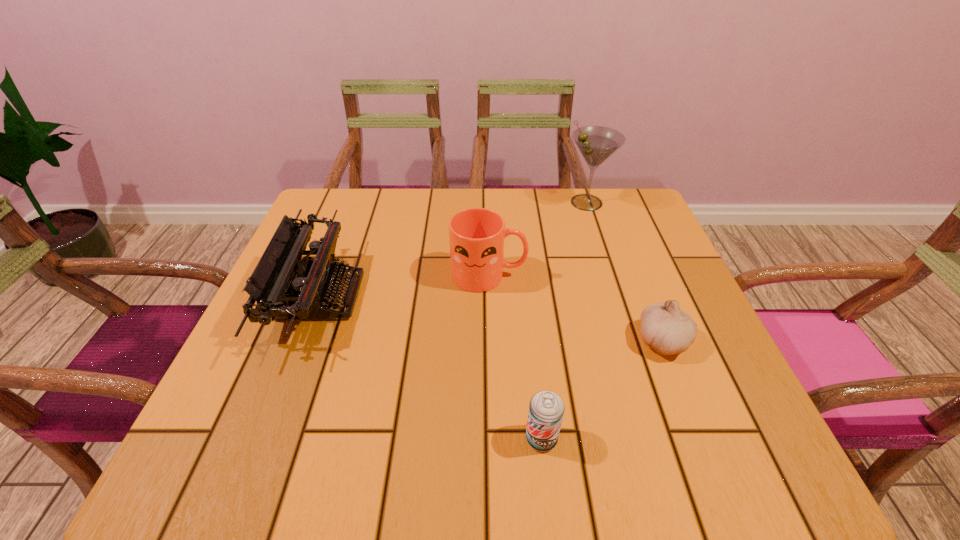
At what (x,y) coordinates should I click in order to perform the action: click on empty space that is in between the beer can and the mug. Please return your answer as a coordinate pair (x, y). The height and width of the screenshot is (540, 960). Looking at the image, I should click on (516, 356).

Where is `empty space that is in between the garlic and the martini`? The width and height of the screenshot is (960, 540). empty space that is in between the garlic and the martini is located at coordinates (625, 272).

Where is `empty location between the leftmost object and the beer can`? empty location between the leftmost object and the beer can is located at coordinates (431, 368).

Locate an element on the screen. This screenshot has width=960, height=540. the second closest object to the garlic is located at coordinates (546, 409).

The width and height of the screenshot is (960, 540). I want to click on the third closest object to the garlic, so click(x=596, y=144).

Locate an element on the screen. Image resolution: width=960 pixels, height=540 pixels. free space that satisfies the following two spatial constraints: 1. on the typing side of the beer can; 2. on the right side of the leftmost object is located at coordinates (266, 438).

You are a GUI agent. You are given a task and a screenshot of the screen. Output one action in this format:
    pyautogui.click(x=<x>, y=<y>)
    Task: Click on the vacant space that satisfies the following two spatial constraints: 1. on the handle side of the garlic; 2. on the right side of the mug
    
    Given the screenshot: What is the action you would take?
    pyautogui.click(x=491, y=341)

You are a GUI agent. You are given a task and a screenshot of the screen. Output one action in this format:
    pyautogui.click(x=<x>, y=<y>)
    Task: Click on the free space that satisfies the following two spatial constraints: 1. on the typing side of the typewriter; 2. on the right side of the beer can
    
    Given the screenshot: What is the action you would take?
    pyautogui.click(x=266, y=438)

Where is `free space that satisfies the following two spatial constraints: 1. on the handle side of the garlic; 2. on the left side of the mug`? free space that satisfies the following two spatial constraints: 1. on the handle side of the garlic; 2. on the left side of the mug is located at coordinates (491, 341).

What are the coordinates of `free point that satisfies the following two spatial constraints: 1. on the handle side of the mug; 2. on the back side of the nearest object` in the screenshot? It's located at (492, 438).